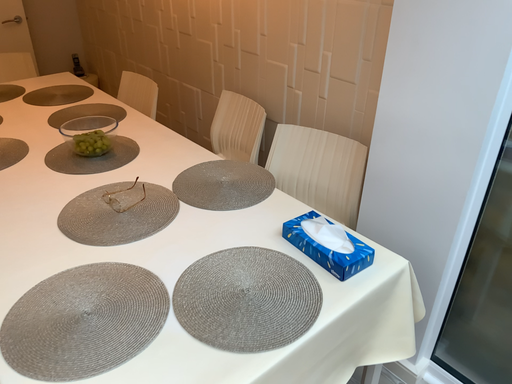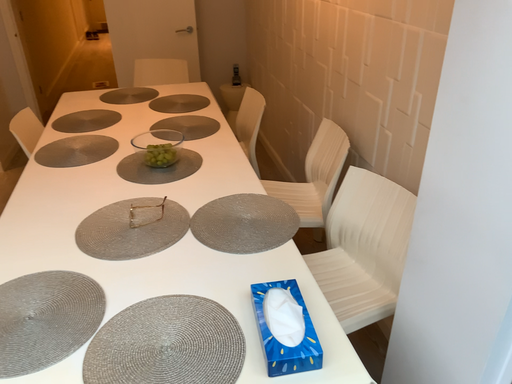
Question: Which way did the camera rotate in the video?

Choices:
 (A) rotated left
 (B) rotated right

Answer: (A)